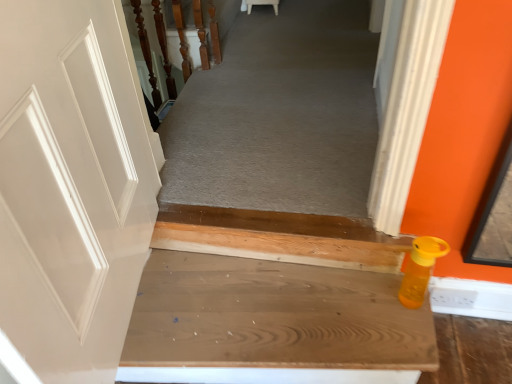
Identify the location of vacant region above wooden stairs at lower right (from a real-world perspective). (281, 318).